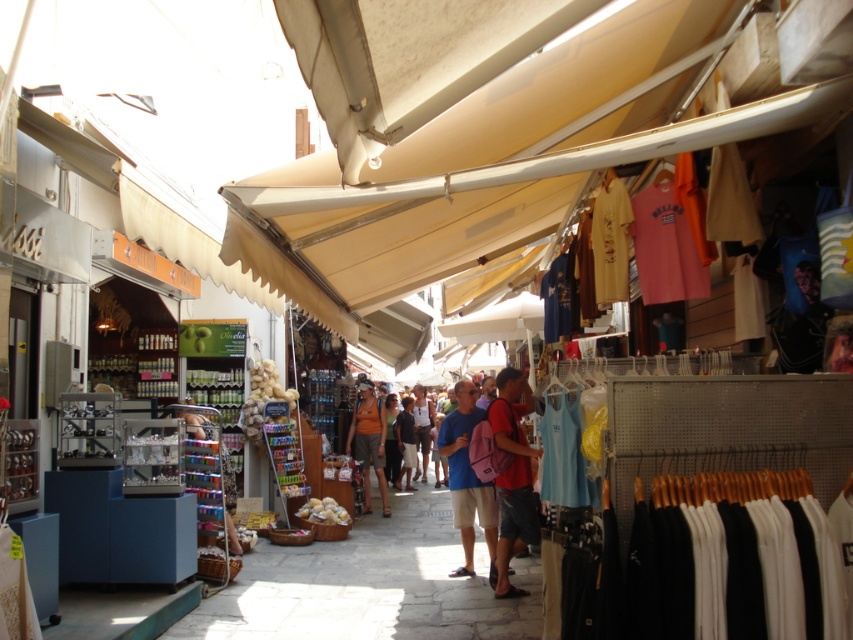
Who is positioned more to the right, orange cotton t-shirt at center or matte white shirt at center?

Positioned to the right is matte white shirt at center.

Who is shorter, orange cotton t-shirt at center or matte white shirt at center?

orange cotton t-shirt at center is shorter.

The width and height of the screenshot is (853, 640). What do you see at coordinates (369, 440) in the screenshot? I see `orange cotton t-shirt at center` at bounding box center [369, 440].

The width and height of the screenshot is (853, 640). I want to click on orange cotton t-shirt at center, so click(x=369, y=440).

Does blue fabric backpack at center have a greater height compared to matte white shirt at center?

Incorrect, blue fabric backpack at center's height is not larger of matte white shirt at center's.

Can you confirm if blue fabric backpack at center is wider than matte white shirt at center?

Indeed, blue fabric backpack at center has a greater width compared to matte white shirt at center.

In order to click on blue fabric backpack at center in this screenshot , I will do `click(467, 477)`.

Between matte red backpack at center and matte blue shirt at center, which one appears on the left side from the viewer's perspective?

Positioned to the left is matte blue shirt at center.

Between matte red backpack at center and matte blue shirt at center, which one has more height?

matte red backpack at center

Where is `matte red backpack at center`? matte red backpack at center is located at coordinates (512, 476).